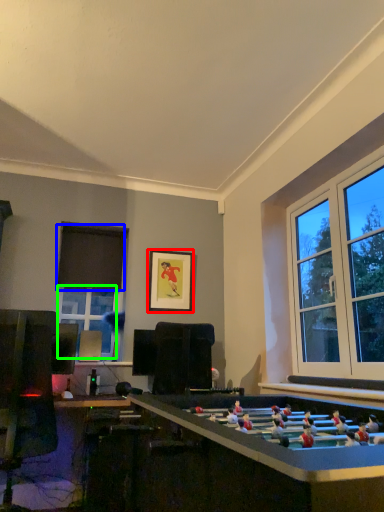
Question: Considering the real-world distances, which object is farthest from picture frame (highlighted by a red box)? curtain (highlighted by a blue box) or window (highlighted by a green box)?

Choices:
 (A) curtain
 (B) window

Answer: (B)